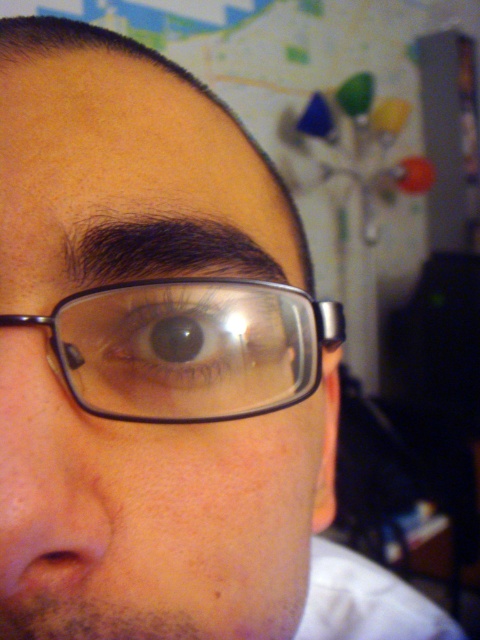
Question: Among these objects, which one is farthest from the camera?

Choices:
 (A) matte skin nose at lower left
 (B) transparent plastic glasses at center
 (C) clear plastic glasses at center
 (D) brown glossy eye at center

Answer: (D)

Question: Observing the image, what is the correct spatial positioning of matte skin nose at lower left in reference to brown glossy eye at center?

Choices:
 (A) above
 (B) below

Answer: (B)

Question: Which point is farther from the camera taking this photo?

Choices:
 (A) (90, 445)
 (B) (289, 308)
 (C) (312, 310)
 (D) (103, 182)

Answer: (C)

Question: Observing the image, what is the correct spatial positioning of transparent plastic glasses at center in reference to matte skin nose at lower left?

Choices:
 (A) above
 (B) below

Answer: (A)

Question: Among these objects, which one is farthest from the camera?

Choices:
 (A) transparent plastic glasses at center
 (B) brown glossy eye at center

Answer: (B)

Question: Can you confirm if transparent plastic glasses at center is wider than brown glossy eye at center?

Choices:
 (A) no
 (B) yes

Answer: (B)